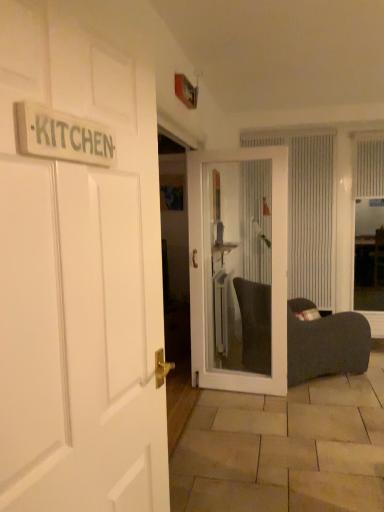
Question: Is wooden sign at upper left situated inside white glass door at center, the 1th door positioned from the back, or outside?

Choices:
 (A) outside
 (B) inside

Answer: (A)

Question: Does point (94, 151) appear closer or farther from the camera than point (211, 179)?

Choices:
 (A) farther
 (B) closer

Answer: (B)

Question: Estimate the real-world distances between objects in this image. Which object is farther from the white textured curtain at center, which is the first curtain in left-to-right order?

Choices:
 (A) white glass door at center, the 1th door positioned from the back
 (B) white textured curtain at upper right, acting as the first curtain starting from the right
 (C) dark gray fabric bean bag at right
 (D) white textured window screen at right
 (E) wooden sign at upper left

Answer: (E)

Question: Which is farther from the white textured curtain at upper right, acting as the first curtain starting from the right?

Choices:
 (A) dark gray fabric bean bag at right
 (B) white textured window screen at right
 (C) white textured curtain at center, placed as the second curtain when sorted from right to left
 (D) white wooden door at left, the second door from the back
 (E) white glass door at center, arranged as the 1th door when viewed from the right

Answer: (D)